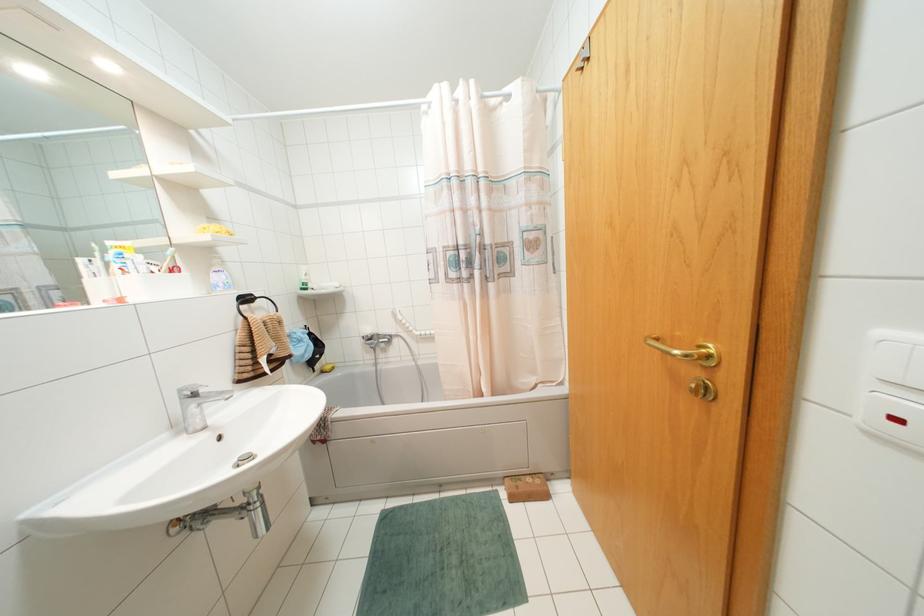
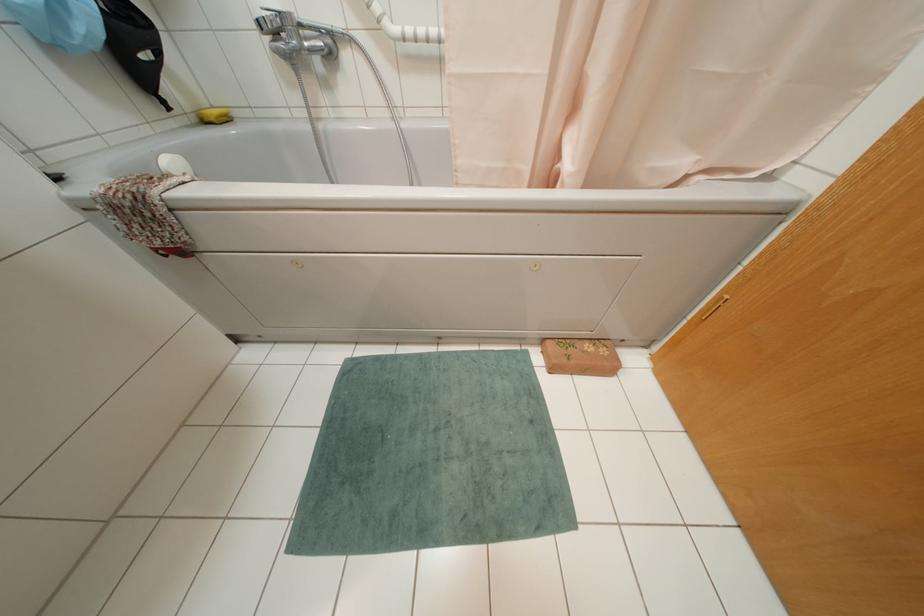
The point at (537, 480) is marked in the first image. Where is the corresponding point in the second image?

(602, 351)